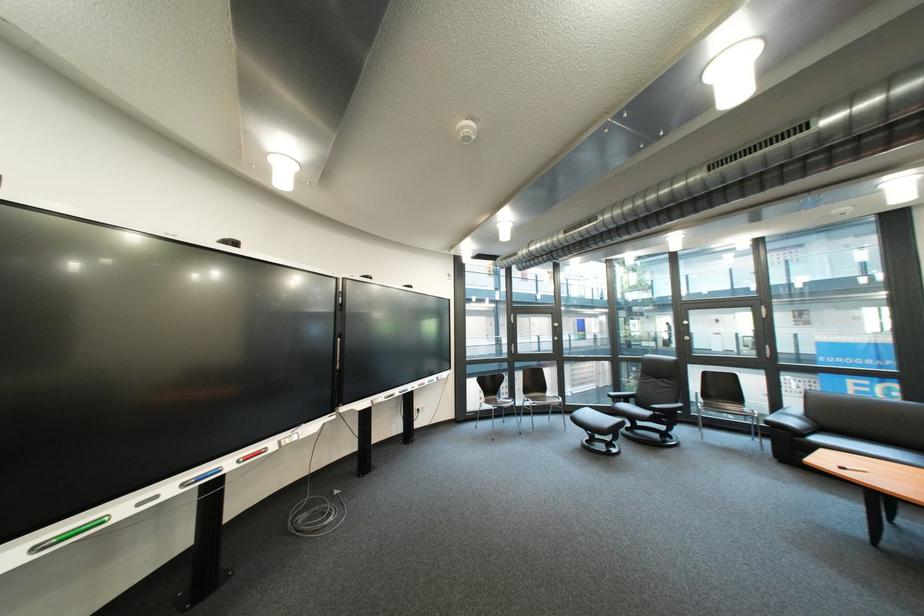
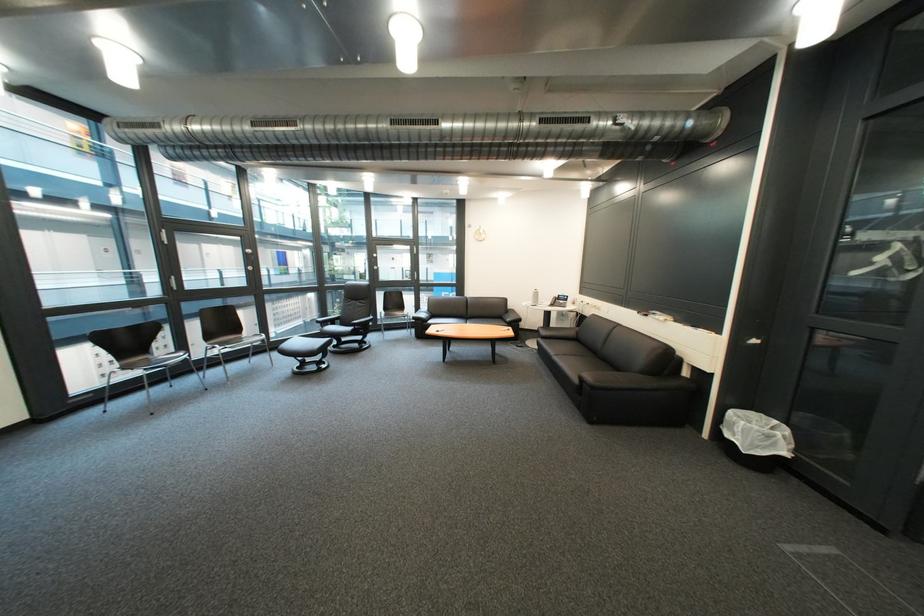
In the second image, find the point that corresponds to (x=832, y=440) in the first image.

(444, 323)